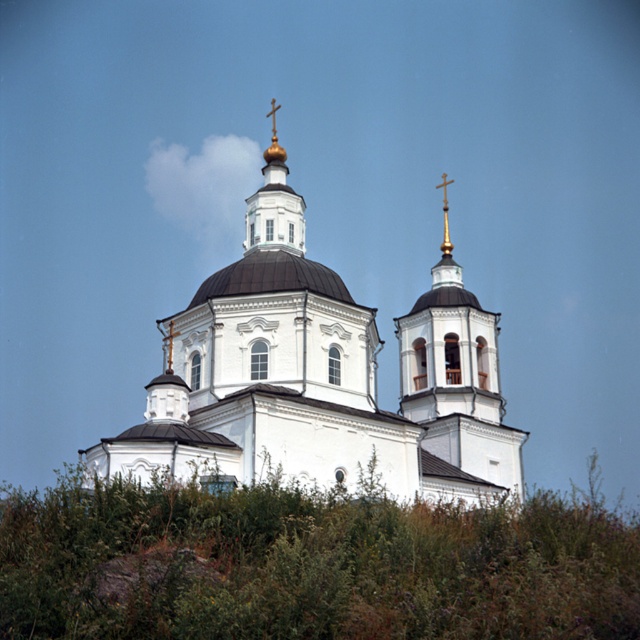
Which is in front, point (164, 588) or point (452, 180)?

Point (164, 588) is in front.

Which is above, green leafy bush at center or gold metallic cross at upper center?

Positioned higher is gold metallic cross at upper center.

Image resolution: width=640 pixels, height=640 pixels. I want to click on green leafy bush at center, so click(x=310, y=564).

Who is positioned more to the left, green leafy bush at center or white smooth church at center?

green leafy bush at center is more to the left.

From the picture: Is green leafy bush at center smaller than white smooth church at center?

No.

Which is in front, point (26, 612) or point (445, 276)?

Positioned in front is point (26, 612).

The width and height of the screenshot is (640, 640). Identify the location of green leafy bush at center. 310,564.

Does white smooth church at center appear on the left side of gold metallic cross at upper center?

Yes, white smooth church at center is to the left of gold metallic cross at upper center.

Is white smooth church at center wider than gold metallic cross at upper center?

Indeed, white smooth church at center has a greater width compared to gold metallic cross at upper center.

Image resolution: width=640 pixels, height=640 pixels. Identify the location of white smooth church at center. (321, 378).